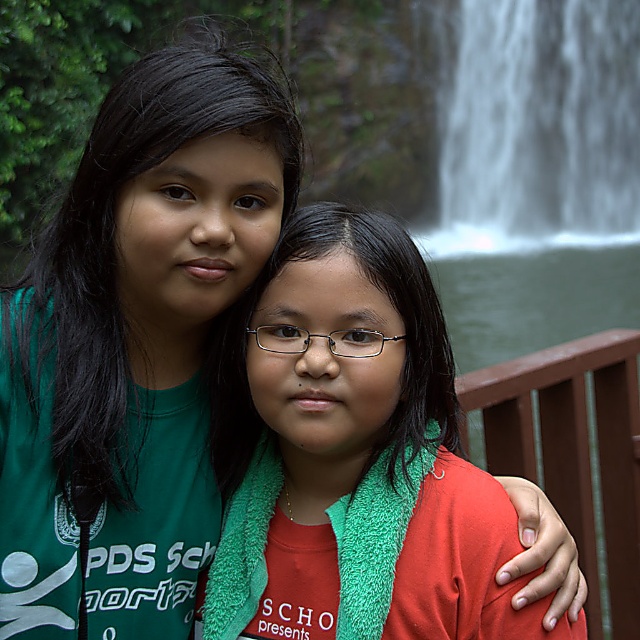
Which of these two, red fleece scarf at center or white misty waterfall at upper right, stands taller?

white misty waterfall at upper right is taller.

Does red fleece scarf at center appear on the right side of white misty waterfall at upper right?

In fact, red fleece scarf at center is to the left of white misty waterfall at upper right.

Between point (365, 266) and point (616, 140), which one is positioned in front?

Point (365, 266) is more forward.

Locate an element on the screen. The image size is (640, 640). red fleece scarf at center is located at coordinates (332, 429).

Who is more forward, [426,586] or [637,518]?

Point [426,586]

What are the coordinates of `red fleece scarf at center` in the screenshot? It's located at (332, 429).

The width and height of the screenshot is (640, 640). What are the coordinates of `red fleece scarf at center` in the screenshot? It's located at (332, 429).

Which is more to the left, white misty waterfall at upper right or brown wooden rail at upper right?

brown wooden rail at upper right

Is white misty waterfall at upper right smaller than brown wooden rail at upper right?

Actually, white misty waterfall at upper right might be larger than brown wooden rail at upper right.

Between point (593, 204) and point (522, 378), which one is positioned in front?

Point (522, 378) is in front.

The image size is (640, 640). I want to click on white misty waterfall at upper right, so click(540, 129).